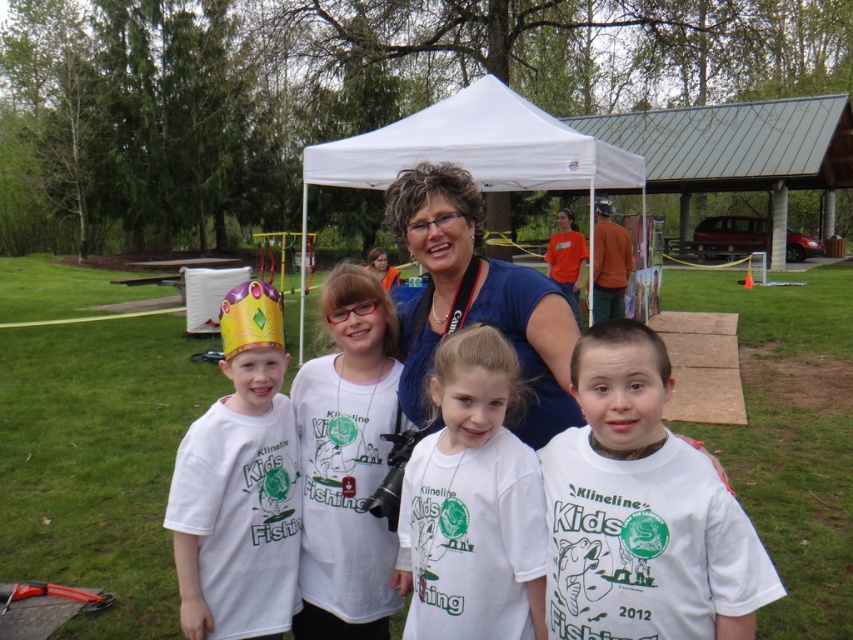
Can you confirm if white cotton shirt at center is smaller than white fabric tent at center?

Yes, white cotton shirt at center is smaller than white fabric tent at center.

Which is more to the left, white cotton shirt at center or white fabric tent at center?

Positioned to the left is white fabric tent at center.

Who is more forward, (473, 531) or (413, 122)?

Positioned in front is point (473, 531).

Where is `white cotton shirt at center`? The image size is (853, 640). white cotton shirt at center is located at coordinates (473, 502).

Who is more distant from viewer, (663, 381) or (511, 342)?

Point (511, 342)

Does white matte shirt at center lie behind white cotton t-shirts at center?

No, white matte shirt at center is in front of white cotton t-shirts at center.

Is point (619, 632) behind point (535, 352)?

No, (619, 632) is closer to viewer.

Locate an element on the screen. white matte shirt at center is located at coordinates (641, 509).

This screenshot has height=640, width=853. What do you see at coordinates (641, 509) in the screenshot?
I see `white matte shirt at center` at bounding box center [641, 509].

Between white matte shirt at center and white cotton shirt at center, which one appears on the right side from the viewer's perspective?

From the viewer's perspective, white matte shirt at center appears more on the right side.

Locate an element on the screen. This screenshot has height=640, width=853. white matte shirt at center is located at coordinates (641, 509).